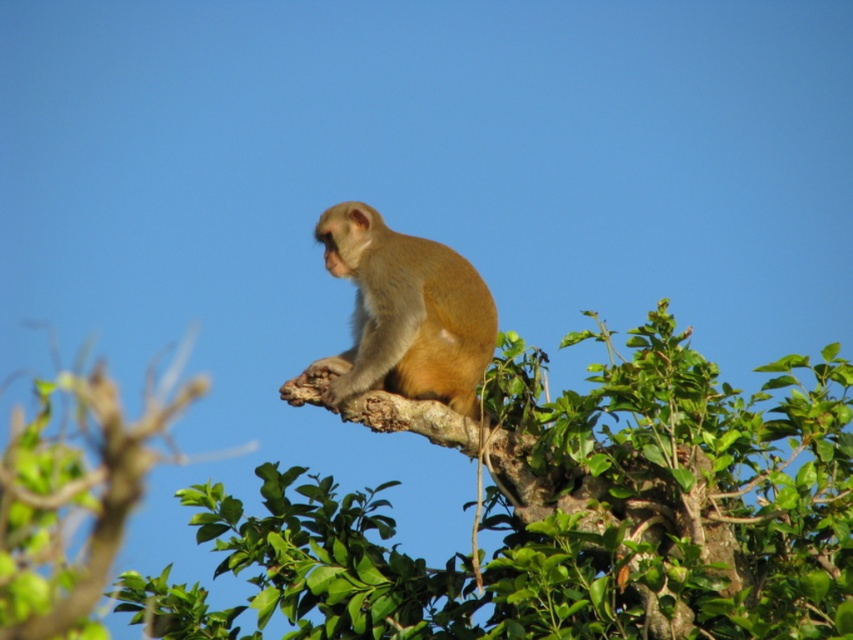
You are a bird flying in the sky and want to land on the green leafy tree at upper center. Based on the coordinates provided, can you determine if the tree is positioned in the upper half of the image?

The green leafy tree at upper center is located at point (570, 516). Since the y coordinate is 0.669, which is above the midpoint of 0.5, the tree is positioned in the upper half of the image.

You are an artist trying to draw the monkey in the scene. You want to ensure the depth perception is accurate. Which of the two points, point (621, 381) or point (410, 282), is closer to you?

Point (621, 381) is closer to the viewer than point (410, 282).